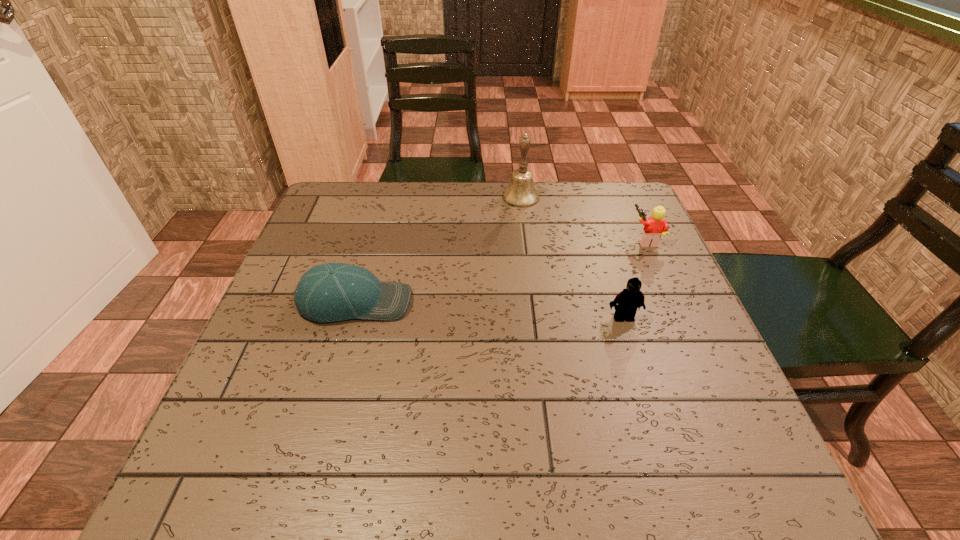
The width and height of the screenshot is (960, 540). I want to click on vacant space located in front of the rightmost object with the accessory visible, so click(x=478, y=239).

Identify the location of vacant space located 0.160m in front of the rightmost object with the accessory visible. The image size is (960, 540). (568, 239).

Locate an element on the screen. free spot located on the face of the nearer Lego is located at coordinates (632, 342).

This screenshot has width=960, height=540. I want to click on vacant area located on the right of the shortest object, so click(x=527, y=302).

Find the location of a particular element. This screenshot has height=540, width=960. bell situated at the far edge is located at coordinates (521, 192).

Locate an element on the screen. The image size is (960, 540). Lego situated at the far edge is located at coordinates (655, 226).

Find the location of `object that is at the left edge`. object that is at the left edge is located at coordinates (330, 292).

Identify the location of object present at the far right corner. (655, 226).

Identify the location of vacant space at the far edge of the desktop. (576, 193).

The width and height of the screenshot is (960, 540). I want to click on vacant space at the near edge of the desktop, so click(631, 492).